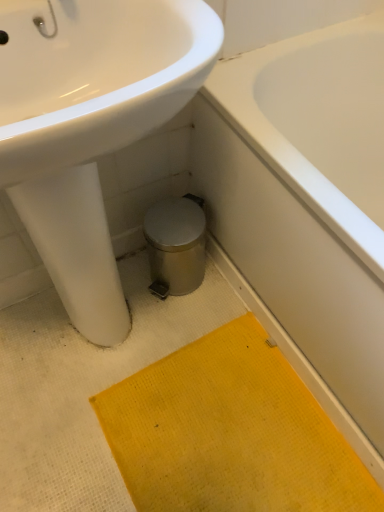
At what (x,y) coordinates should I click in order to perform the action: click on free spot to the left of yellow textured bath mat at lower center. Please return your answer as a coordinate pair (x, y). The height and width of the screenshot is (512, 384). Looking at the image, I should click on (59, 407).